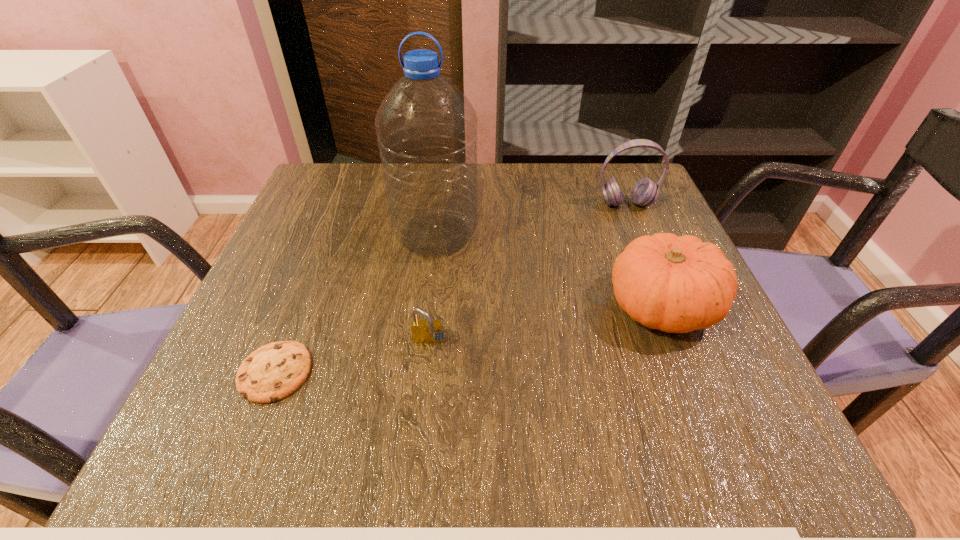
This screenshot has height=540, width=960. I want to click on vacant area located on the front of the leftmost object, so click(250, 436).

This screenshot has width=960, height=540. I want to click on water jug that is at the far edge, so click(426, 128).

The height and width of the screenshot is (540, 960). Find the location of `headset positioned at the far edge`. headset positioned at the far edge is located at coordinates (645, 192).

Where is `object that is at the left edge`? The image size is (960, 540). object that is at the left edge is located at coordinates (271, 373).

Where is `headset that is at the right edge`? The width and height of the screenshot is (960, 540). headset that is at the right edge is located at coordinates (645, 192).

The height and width of the screenshot is (540, 960). In order to click on pumpkin located at the right edge in this screenshot , I will do `click(675, 284)`.

Find the location of a particular element. This screenshot has height=540, width=960. object located in the far right corner section of the desktop is located at coordinates (645, 192).

You are a GUI agent. You are given a task and a screenshot of the screen. Output one action in this format:
    pyautogui.click(x=<x>, y=<y>)
    Task: Click on the free space at the near edge of the desktop
    The image size is (960, 540).
    Given the screenshot: What is the action you would take?
    pyautogui.click(x=320, y=450)

Locate an element on the screen. The image size is (960, 540). blank area at the left edge is located at coordinates (296, 298).

In the image, there is a desktop. Identify the location of free region at the right edge. (729, 347).